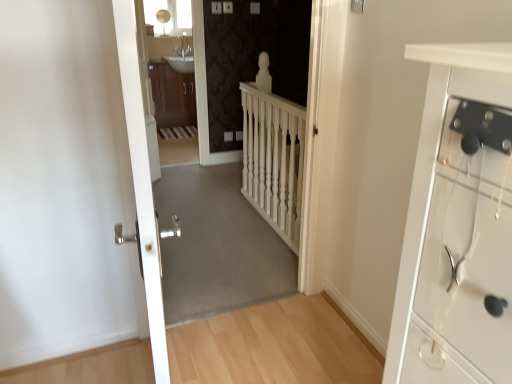
Question: Does white metallic door at center turn towards white wooden balustrade at center?

Choices:
 (A) yes
 (B) no

Answer: (B)

Question: Can you confirm if white metallic door at center is positioned to the left of white wooden balustrade at center?

Choices:
 (A) no
 (B) yes

Answer: (B)

Question: Are white metallic door at center and white wooden balustrade at center making contact?

Choices:
 (A) yes
 (B) no

Answer: (B)

Question: Considering the relative sizes of white metallic door at center and white wooden balustrade at center in the image provided, is white metallic door at center wider than white wooden balustrade at center?

Choices:
 (A) no
 (B) yes

Answer: (B)

Question: From the image's perspective, does white metallic door at center appear higher than white wooden balustrade at center?

Choices:
 (A) yes
 (B) no

Answer: (B)

Question: From a real-world perspective, is white metallic door at center positioned over white wooden balustrade at center based on gravity?

Choices:
 (A) no
 (B) yes

Answer: (B)

Question: From a real-world perspective, is light wood floor at center physically below white metallic door at center?

Choices:
 (A) yes
 (B) no

Answer: (A)

Question: From the image's perspective, is light wood floor at center on top of white metallic door at center?

Choices:
 (A) no
 (B) yes

Answer: (A)

Question: Does light wood floor at center have a greater width compared to white metallic door at center?

Choices:
 (A) no
 (B) yes

Answer: (B)

Question: Does light wood floor at center lie in front of white metallic door at center?

Choices:
 (A) no
 (B) yes

Answer: (A)

Question: Is light wood floor at center positioned far away from white metallic door at center?

Choices:
 (A) yes
 (B) no

Answer: (B)

Question: Is white metallic door at center inside light wood floor at center?

Choices:
 (A) yes
 (B) no

Answer: (B)

Question: From the image's perspective, would you say white plastic electric outlet at center is shown under wooden cabinet at center?

Choices:
 (A) no
 (B) yes

Answer: (B)